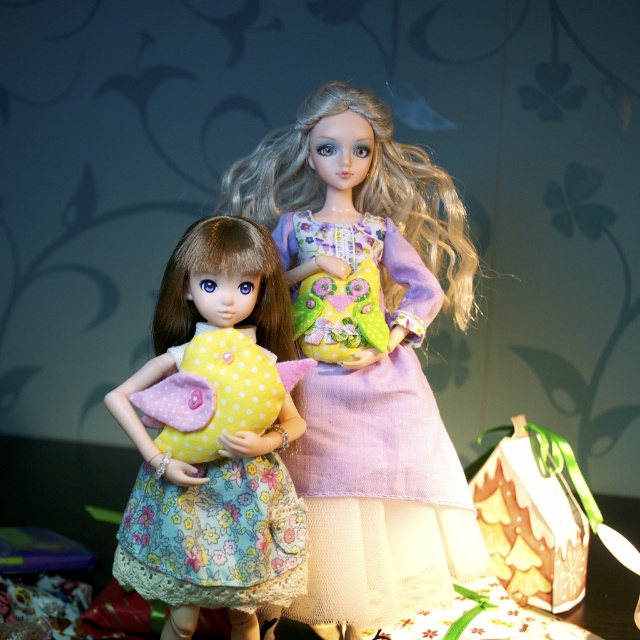
Does lavender cotton dress at center have a larger size compared to floral fabric dress at center?

Yes.

Who is more forward, (400, 586) or (120, 522)?

Point (120, 522) is in front.

Which is behind, point (440, 540) or point (140, 488)?

Point (440, 540)

You are a GUI agent. You are given a task and a screenshot of the screen. Output one action in this format:
    pyautogui.click(x=<x>, y=<y>)
    Task: Click on the lavender cotton dress at center
    Image resolution: width=640 pixels, height=640 pixels.
    Given the screenshot: What is the action you would take?
    pyautogui.click(x=378, y=456)